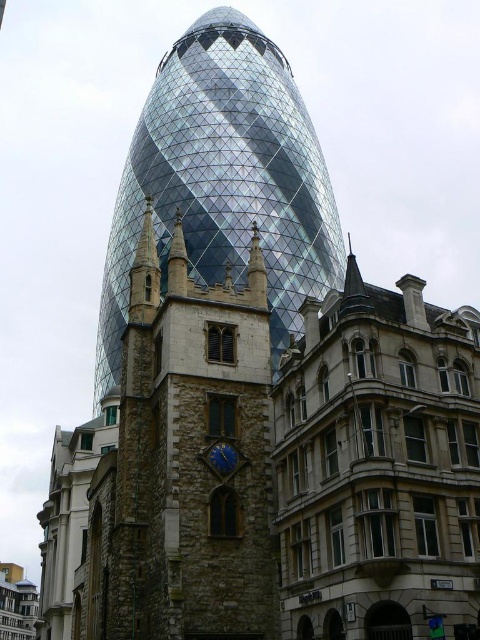
Question: Which object is farther from the camera taking this photo?

Choices:
 (A) stone clock tower at center
 (B) stone clock tower at center-left
 (C) blue stone clock at center

Answer: (A)

Question: Among these objects, which one is nearest to the camera?

Choices:
 (A) stone clock tower at center-left
 (B) blue stone clock at center

Answer: (A)

Question: Considering the real-world distances, which object is closest to the stone clock tower at center-left?

Choices:
 (A) blue stone clock at center
 (B) stone clock tower at center

Answer: (A)

Question: Can you confirm if stone clock tower at center is bigger than blue stone clock at center?

Choices:
 (A) no
 (B) yes

Answer: (B)

Question: Does stone clock tower at center-left have a lesser width compared to stone clock tower at center?

Choices:
 (A) no
 (B) yes

Answer: (B)

Question: Can you confirm if stone clock tower at center-left is positioned to the right of blue stone clock at center?

Choices:
 (A) yes
 (B) no

Answer: (B)